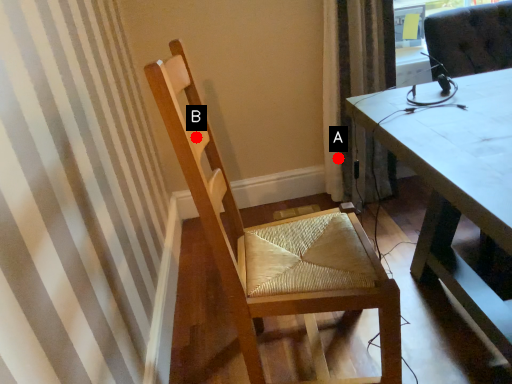
Question: Two points are circled on the image, labeled by A and B beside each circle. Which point is closer to the camera?

Choices:
 (A) A is closer
 (B) B is closer

Answer: (B)